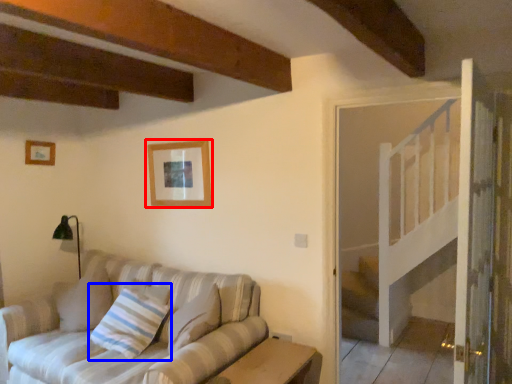
Question: Which object is closer to the camera taking this photo, picture frame (highlighted by a red box) or pillow (highlighted by a blue box)?

Choices:
 (A) picture frame
 (B) pillow

Answer: (B)